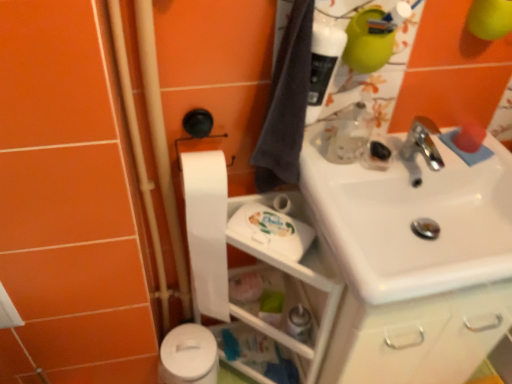
The width and height of the screenshot is (512, 384). Identify the location of white glossy sink at upper right. (412, 219).

Image resolution: width=512 pixels, height=384 pixels. Describe the element at coordinates (324, 60) in the screenshot. I see `translucent plastic bottle at upper right` at that location.

This screenshot has width=512, height=384. Find the location of `white plastic shelf at lower center`. white plastic shelf at lower center is located at coordinates (288, 280).

Measure the distance between white plastic shelf at lower center and camera.

A: 36.38 inches.

This screenshot has width=512, height=384. What are the coordinates of `white glossy sink at upper right` in the screenshot? It's located at (412, 219).

Which of these two, white matte toilet paper at center-left, which is the 2th toilet paper from bottom to top, or dark gray fabric bath towel at upper right, is bigger?

With larger size is white matte toilet paper at center-left, which is the 2th toilet paper from bottom to top.

Considering the relative positions of white matte toilet paper at center-left, which is the first toilet paper from top to bottom, and dark gray fabric bath towel at upper right in the image provided, is white matte toilet paper at center-left, which is the first toilet paper from top to bottom, to the left or to the right of dark gray fabric bath towel at upper right?

Based on their positions, white matte toilet paper at center-left, which is the first toilet paper from top to bottom, is located to the left of dark gray fabric bath towel at upper right.

Can you tell me how much white matte toilet paper at center-left, which is the first toilet paper from top to bottom, and dark gray fabric bath towel at upper right differ in facing direction?

The angle between the facing direction of white matte toilet paper at center-left, which is the first toilet paper from top to bottom, and the facing direction of dark gray fabric bath towel at upper right is 0.000154 degrees.

From the image's perspective, starting from the dark gray fabric bath towel at upper right, which toilet paper is the 1st one below? Please provide its 2D coordinates.

[(207, 230)]

Is point (196, 337) more distant than point (298, 314)?

That is True.

Locate an element on the screen. The height and width of the screenshot is (384, 512). toiletry in front of the white matte toilet paper at lower left, which is the first toilet paper from bottom to top is located at coordinates (298, 323).

Consider the image. From a real-world perspective, is white matte toilet paper at lower left, which is the first toilet paper from bottom to top, physically located above or below translucent plastic spray bottle at lower center?

white matte toilet paper at lower left, which is the first toilet paper from bottom to top, is below translucent plastic spray bottle at lower center.

Is the depth of white matte toilet paper at lower left, the 2th toilet paper viewed from the top, greater than that of translucent plastic spray bottle at lower center?

That is True.

Between point (478, 244) and point (205, 242), which one is positioned in front?

Point (478, 244)

Does white glossy sink at upper right turn towards white matte toilet paper at center-left, which is the 2th toilet paper from bottom to top?

No, white glossy sink at upper right does not turn towards white matte toilet paper at center-left, which is the 2th toilet paper from bottom to top.

How many degrees apart are the facing directions of white glossy sink at upper right and white matte toilet paper at center-left, which is the 2th toilet paper from bottom to top?

The angular difference between white glossy sink at upper right and white matte toilet paper at center-left, which is the 2th toilet paper from bottom to top, is 0.849 degrees.

Can you confirm if white glossy sink at upper right is positioned to the left of white matte toilet paper at center-left, which is the first toilet paper from top to bottom?

No.

From the image's perspective, who appears lower, translucent plastic bottle at upper right or white matte toilet paper at lower left, which is the first toilet paper from bottom to top?

white matte toilet paper at lower left, which is the first toilet paper from bottom to top, is shown below in the image.

Is the surface of translucent plastic bottle at upper right in direct contact with white matte toilet paper at lower left, which is the first toilet paper from bottom to top?

No, translucent plastic bottle at upper right is not beside white matte toilet paper at lower left, which is the first toilet paper from bottom to top.

The height and width of the screenshot is (384, 512). I want to click on cleaning product to the right of white matte toilet paper at lower left, which is the first toilet paper from bottom to top, so click(x=324, y=60).

Does dark gray fabric bath towel at upper right appear on the right side of white plastic shelf at lower center?

Yes.

Can we say dark gray fabric bath towel at upper right lies outside white plastic shelf at lower center?

Yes, dark gray fabric bath towel at upper right is not within white plastic shelf at lower center.

Is point (270, 127) more distant than point (306, 279)?

Yes, it is behind point (306, 279).

Looking at the image, does dark gray fabric bath towel at upper right seem bigger or smaller compared to white plastic shelf at lower center?

In the image, dark gray fabric bath towel at upper right appears to be smaller than white plastic shelf at lower center.

Based on the photo, how much distance is there between white glossy sink at upper right and dark gray fabric bath towel at upper right?

white glossy sink at upper right and dark gray fabric bath towel at upper right are 27.48 centimeters apart.

From a real-world perspective, is white glossy sink at upper right located beneath dark gray fabric bath towel at upper right?

Yes, from a real-world perspective, white glossy sink at upper right is below dark gray fabric bath towel at upper right.

Between white glossy sink at upper right and dark gray fabric bath towel at upper right, which one has less height?

white glossy sink at upper right.

Which is nearer, (414,249) or (298,43)?

Point (298,43)

Is translucent plastic bottle at upper right further to the viewer compared to white plastic shelf at lower center?

No, translucent plastic bottle at upper right is closer to the camera.

Between translucent plastic bottle at upper right and white plastic shelf at lower center, which one appears on the right side from the viewer's perspective?

translucent plastic bottle at upper right is more to the right.

Which point is more forward, (x=339, y=58) or (x=278, y=196)?

Point (x=339, y=58)

This screenshot has width=512, height=384. Find the location of `the 1st toilet paper behind the dark gray fabric bath towel at upper right, starting your count from the anchor`. the 1st toilet paper behind the dark gray fabric bath towel at upper right, starting your count from the anchor is located at coordinates (207, 230).

Locate an element on the screen. This screenshot has height=384, width=512. toilet paper below the translucent plastic spray bottle at lower center (from the image's perspective) is located at coordinates (188, 355).

When comparing their distances from white matte toilet paper at lower left, which is the first toilet paper from bottom to top, does translucent plastic spray bottle at lower center or translucent plastic bottle at upper right seem closer?

translucent plastic spray bottle at lower center is positioned closer to the anchor white matte toilet paper at lower left, which is the first toilet paper from bottom to top.

Which object lies nearer to the anchor point white matte toilet paper at center-left, which is the first toilet paper from top to bottom, translucent plastic bottle at upper right or dark gray fabric bath towel at upper right?

dark gray fabric bath towel at upper right lies closer to white matte toilet paper at center-left, which is the first toilet paper from top to bottom, than the other object.

Considering their positions, is white glossy sink at upper right positioned closer to white matte toilet paper at lower left, which is the first toilet paper from bottom to top, than white matte toilet paper at center-left, which is the first toilet paper from top to bottom?

white matte toilet paper at center-left, which is the first toilet paper from top to bottom, is closer to white matte toilet paper at lower left, which is the first toilet paper from bottom to top.

Which object lies nearer to the anchor point translucent plastic spray bottle at lower center, white plastic shelf at lower center or white matte toilet paper at center-left, which is the first toilet paper from top to bottom?

Based on the image, white plastic shelf at lower center appears to be nearer to translucent plastic spray bottle at lower center.

Based on the photo, considering their positions, is white plastic shelf at lower center positioned further to white matte toilet paper at center-left, which is the first toilet paper from top to bottom, than white matte toilet paper at lower left, the 2th toilet paper viewed from the top?

white matte toilet paper at lower left, the 2th toilet paper viewed from the top, lies further to white matte toilet paper at center-left, which is the first toilet paper from top to bottom, than the other object.

Based on their spatial positions, is white matte toilet paper at lower left, which is the first toilet paper from bottom to top, or white matte toilet paper at center-left, which is the first toilet paper from top to bottom, closer to white glossy sink at upper right?

white matte toilet paper at center-left, which is the first toilet paper from top to bottom.

From the image, which object appears to be nearer to white glossy sink at upper right, translucent plastic bottle at upper right or translucent plastic spray bottle at lower center?

Based on the image, translucent plastic bottle at upper right appears to be nearer to white glossy sink at upper right.

Estimate the real-world distances between objects in this image. Which object is further from white glossy sink at upper right, white plastic shelf at lower center or translucent plastic spray bottle at lower center?

Based on the image, translucent plastic spray bottle at lower center appears to be further to white glossy sink at upper right.

Where is `toilet paper between dark gray fabric bath towel at upper right and translucent plastic spray bottle at lower center in the vertical direction`? This screenshot has height=384, width=512. toilet paper between dark gray fabric bath towel at upper right and translucent plastic spray bottle at lower center in the vertical direction is located at coordinates (207, 230).

Locate an element on the screen. The image size is (512, 384). shelf between dark gray fabric bath towel at upper right and white matte toilet paper at lower left, which is the first toilet paper from bottom to top, in the vertical direction is located at coordinates (288, 280).

Identify the location of toiletry that lies between white matte toilet paper at center-left, which is the first toilet paper from top to bottom, and white matte toilet paper at lower left, the 2th toilet paper viewed from the top, from top to bottom. (298, 323).

Find the location of a particular element. shelf between white matte toilet paper at center-left, which is the 2th toilet paper from bottom to top, and white matte toilet paper at lower left, the 2th toilet paper viewed from the top, from top to bottom is located at coordinates (288, 280).